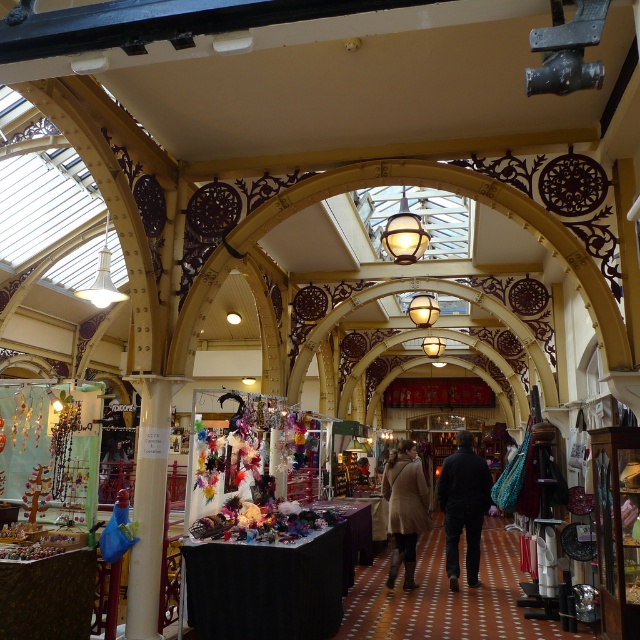
Question: Which of the following is the closest to the observer?

Choices:
 (A) 460,458
 (B) 397,504

Answer: (B)

Question: Does dark blue jeans at center have a greater width compared to beige wool coat at center?

Choices:
 (A) yes
 (B) no

Answer: (A)

Question: Can you confirm if dark blue jeans at center is wider than beige wool coat at center?

Choices:
 (A) no
 (B) yes

Answer: (B)

Question: Observing the image, what is the correct spatial positioning of dark blue jeans at center in reference to beige wool coat at center?

Choices:
 (A) above
 (B) below

Answer: (A)